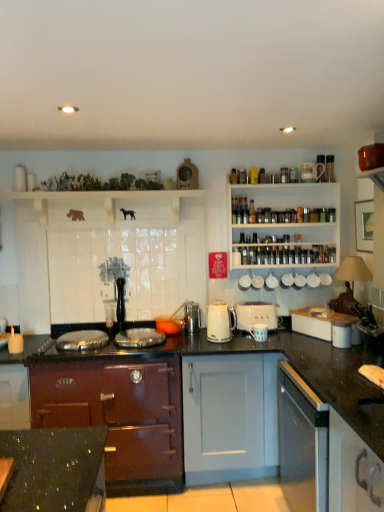
Where is `empty space that is ontop of clear glass spice jars at upper right (from a real-world perspective)`? This screenshot has width=384, height=512. empty space that is ontop of clear glass spice jars at upper right (from a real-world perspective) is located at coordinates (294, 170).